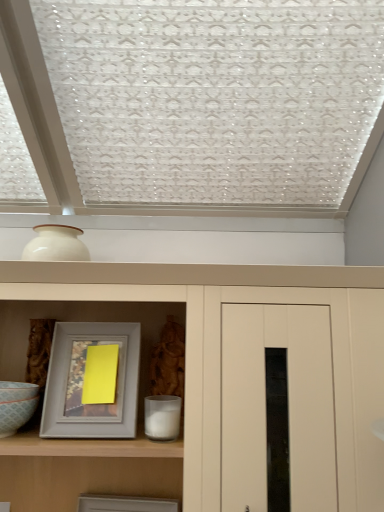
Identify the location of matte gray picture frame at lower center, the second picture frame viewed from the top. (125, 504).

What do you see at coordinates (16, 405) in the screenshot? I see `matte white bowl at lower left` at bounding box center [16, 405].

Where is `matte white bowl at lower left`? matte white bowl at lower left is located at coordinates (16, 405).

Locate an element on the screen. This screenshot has width=384, height=512. gray matte picture frame at center, which is counted as the 2th picture frame, starting from the bottom is located at coordinates (83, 382).

Is matte gray picture frame at lower center, the second picture frame viewed from the top, taller than matte white cupboard at center?

In fact, matte gray picture frame at lower center, the second picture frame viewed from the top, may be shorter than matte white cupboard at center.

Is matte gray picture frame at lower center, the second picture frame viewed from the top, in front of or behind matte white cupboard at center in the image?

Clearly, matte gray picture frame at lower center, the second picture frame viewed from the top, is behind matte white cupboard at center.

Consider the image. From a real-world perspective, does matte gray picture frame at lower center, the 1th picture frame positioned from the bottom, sit lower than matte white cupboard at center?

Yes, from a real-world perspective, matte gray picture frame at lower center, the 1th picture frame positioned from the bottom, is under matte white cupboard at center.

Are matte gray picture frame at lower center, the 1th picture frame positioned from the bottom, and matte white cupboard at center located far from each other?

No, matte gray picture frame at lower center, the 1th picture frame positioned from the bottom, is not far away from matte white cupboard at center.

Image resolution: width=384 pixels, height=512 pixels. In order to click on glass bowl below the gray matte picture frame at center, the 1th picture frame when ordered from top to bottom (from a real-world perspective) in this screenshot , I will do `click(16, 405)`.

Is gray matte picture frame at center, which is counted as the 2th picture frame, starting from the bottom, touching matte white bowl at lower left?

No, gray matte picture frame at center, which is counted as the 2th picture frame, starting from the bottom, is not beside matte white bowl at lower left.

Could you measure the distance between gray matte picture frame at center, the 1th picture frame when ordered from top to bottom, and matte white bowl at lower left?

They are 4.92 inches apart.

Looking at this image, choose the correct answer: Is gray matte picture frame at center, the 1th picture frame when ordered from top to bottom, inside matte white bowl at lower left or outside it?

gray matte picture frame at center, the 1th picture frame when ordered from top to bottom, lies outside matte white bowl at lower left.

From the picture: Who is more distant, matte white bowl at lower left or matte white cupboard at center?

Positioned behind is matte white bowl at lower left.

What's the angular difference between matte white bowl at lower left and matte white cupboard at center's facing directions?

0.207 degrees.

Considering the sizes of objects matte white bowl at lower left and matte white cupboard at center in the image provided, who is wider, matte white bowl at lower left or matte white cupboard at center?

matte white cupboard at center is wider.

Is matte white bowl at lower left located outside matte white cupboard at center?

No, matte white bowl at lower left is inside matte white cupboard at center's boundary.

Is point (367, 317) less distant than point (42, 426)?

Yes, it is in front of point (42, 426).

Considering the relative sizes of matte white cupboard at center and gray matte picture frame at center, which is counted as the 2th picture frame, starting from the bottom, in the image provided, is matte white cupboard at center thinner than gray matte picture frame at center, which is counted as the 2th picture frame, starting from the bottom,?

Incorrect, the width of matte white cupboard at center is not less than that of gray matte picture frame at center, which is counted as the 2th picture frame, starting from the bottom.

Who is bigger, matte white cupboard at center or gray matte picture frame at center, the 1th picture frame when ordered from top to bottom?

matte white cupboard at center is bigger.

From the image's perspective, between matte white cupboard at center and gray matte picture frame at center, the 1th picture frame when ordered from top to bottom, who is located below?

matte white cupboard at center is shown below in the image.

Considering the positions of objects gray matte picture frame at center, which is counted as the 2th picture frame, starting from the bottom, and matte white cupboard at center in the image provided, who is more to the right, gray matte picture frame at center, which is counted as the 2th picture frame, starting from the bottom, or matte white cupboard at center?

Positioned to the right is matte white cupboard at center.

Is gray matte picture frame at center, which is counted as the 2th picture frame, starting from the bottom, aimed at matte white cupboard at center?

Yes, gray matte picture frame at center, which is counted as the 2th picture frame, starting from the bottom, is facing matte white cupboard at center.

Which is behind, point (128, 370) or point (337, 339)?

The point (128, 370) is more distant.

How different are the orientations of gray matte picture frame at center, which is counted as the 2th picture frame, starting from the bottom, and matte white cupboard at center in degrees?

4.4 degrees.

From the picture: Can you confirm if matte white bowl at lower left is bigger than gray matte picture frame at center, the 1th picture frame when ordered from top to bottom?

No.

Considering the relative sizes of matte white bowl at lower left and gray matte picture frame at center, the 1th picture frame when ordered from top to bottom, in the image provided, is matte white bowl at lower left shorter than gray matte picture frame at center, the 1th picture frame when ordered from top to bottom,?

Correct, matte white bowl at lower left is not as tall as gray matte picture frame at center, the 1th picture frame when ordered from top to bottom.

Is the depth of matte white bowl at lower left greater than that of gray matte picture frame at center, the 1th picture frame when ordered from top to bottom?

No, it is in front of gray matte picture frame at center, the 1th picture frame when ordered from top to bottom.

Is matte white bowl at lower left turned away from gray matte picture frame at center, the 1th picture frame when ordered from top to bottom?

No, gray matte picture frame at center, the 1th picture frame when ordered from top to bottom, is not at the back of matte white bowl at lower left.

From a real-world perspective, is matte gray picture frame at lower center, the second picture frame viewed from the top, above or below matte white bowl at lower left?

In terms of real-world spatial position, matte gray picture frame at lower center, the second picture frame viewed from the top, is below matte white bowl at lower left.

Between matte gray picture frame at lower center, the 1th picture frame positioned from the bottom, and matte white bowl at lower left, which one has larger size?

Bigger between the two is matte gray picture frame at lower center, the 1th picture frame positioned from the bottom.

Considering the relative sizes of matte gray picture frame at lower center, the second picture frame viewed from the top, and matte white bowl at lower left in the image provided, is matte gray picture frame at lower center, the second picture frame viewed from the top, thinner than matte white bowl at lower left?

Correct, the width of matte gray picture frame at lower center, the second picture frame viewed from the top, is less than that of matte white bowl at lower left.

Is matte gray picture frame at lower center, the second picture frame viewed from the top, inside the boundaries of matte white bowl at lower left, or outside?

matte gray picture frame at lower center, the second picture frame viewed from the top, is spatially situated outside matte white bowl at lower left.

Identify the location of picture frame lying below the matte white cupboard at center (from the image's perspective). (125, 504).

Locate an element on the screen. Image resolution: width=384 pixels, height=512 pixels. picture frame above the matte white bowl at lower left (from a real-world perspective) is located at coordinates (83, 382).

Based on their spatial positions, is gray matte picture frame at center, which is counted as the 2th picture frame, starting from the bottom, or matte white bowl at lower left closer to matte gray picture frame at lower center, the second picture frame viewed from the top?

The object closer to matte gray picture frame at lower center, the second picture frame viewed from the top, is gray matte picture frame at center, which is counted as the 2th picture frame, starting from the bottom.

From the picture: Looking at the image, which one is located closer to matte white cupboard at center, matte white bowl at lower left or matte gray picture frame at lower center, the second picture frame viewed from the top?

matte white bowl at lower left is closer to matte white cupboard at center.

From the image, which object appears to be nearer to matte white bowl at lower left, matte white cupboard at center or gray matte picture frame at center, the 1th picture frame when ordered from top to bottom?

gray matte picture frame at center, the 1th picture frame when ordered from top to bottom, is positioned closer to the anchor matte white bowl at lower left.

In the scene shown: From the image, which object appears to be farther from matte white cupboard at center, matte white bowl at lower left or gray matte picture frame at center, which is counted as the 2th picture frame, starting from the bottom?

matte white bowl at lower left is positioned further to the anchor matte white cupboard at center.

From the image, which object appears to be nearer to matte white cupboard at center, matte gray picture frame at lower center, the second picture frame viewed from the top, or matte white bowl at lower left?

The object closer to matte white cupboard at center is matte white bowl at lower left.

Considering their positions, is matte white cupboard at center positioned closer to matte gray picture frame at lower center, the 1th picture frame positioned from the bottom, than matte white bowl at lower left?

matte white bowl at lower left lies closer to matte gray picture frame at lower center, the 1th picture frame positioned from the bottom, than the other object.

Which object lies further to the anchor point matte gray picture frame at lower center, the 1th picture frame positioned from the bottom, matte white bowl at lower left or matte white cupboard at center?

The object further to matte gray picture frame at lower center, the 1th picture frame positioned from the bottom, is matte white cupboard at center.

From the picture: Looking at the image, which one is located further to matte white bowl at lower left, matte white cupboard at center or matte gray picture frame at lower center, the 1th picture frame positioned from the bottom?

matte white cupboard at center is positioned further to the anchor matte white bowl at lower left.

Where is `cupboard between gray matte picture frame at center, the 1th picture frame when ordered from top to bottom, and matte gray picture frame at lower center, the 1th picture frame positioned from the bottom, from top to bottom`? cupboard between gray matte picture frame at center, the 1th picture frame when ordered from top to bottom, and matte gray picture frame at lower center, the 1th picture frame positioned from the bottom, from top to bottom is located at coordinates (221, 349).

Identify the location of glass bowl that lies between gray matte picture frame at center, which is counted as the 2th picture frame, starting from the bottom, and matte gray picture frame at lower center, the 1th picture frame positioned from the bottom, from top to bottom. click(x=16, y=405).